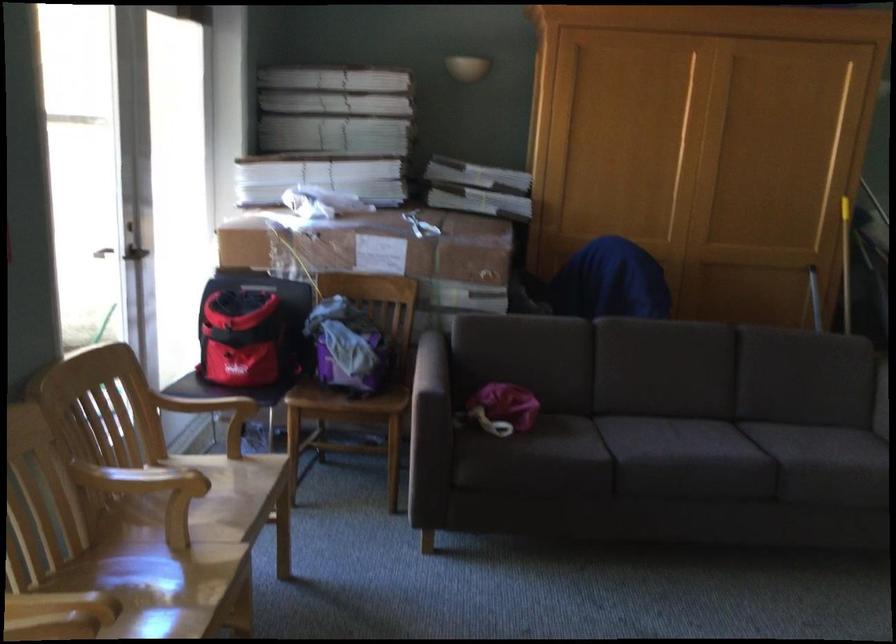
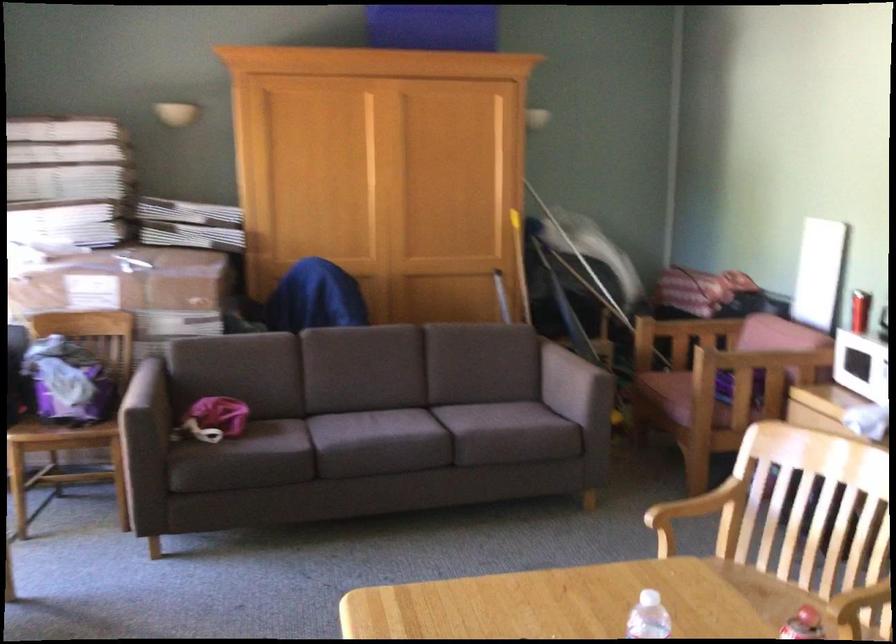
Question: Based on the continuous images, in which direction is the camera rotating? Reply with the corresponding letter.

Choices:
 (A) Left
 (B) Right
 (C) Up
 (D) Down

Answer: (B)